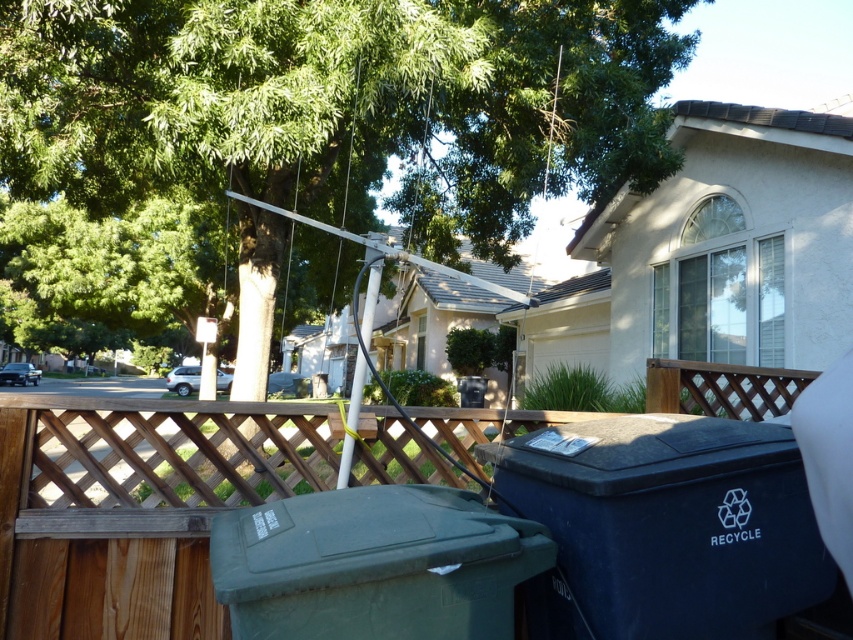
Which of these two, matte black recycling bin at lower right or green plastic recycling bin at lower center, stands taller?

matte black recycling bin at lower right is taller.

Can you confirm if matte black recycling bin at lower right is positioned below green plastic recycling bin at lower center?

Correct, matte black recycling bin at lower right is located below green plastic recycling bin at lower center.

The height and width of the screenshot is (640, 853). I want to click on matte black recycling bin at lower right, so click(665, 525).

Locate an element on the screen. matte black recycling bin at lower right is located at coordinates pyautogui.click(x=665, y=525).

Can you confirm if green leafy tree at upper left is wider than matte black recycling bin at lower right?

Indeed, green leafy tree at upper left has a greater width compared to matte black recycling bin at lower right.

Who is more distant from viewer, (322, 300) or (692, 518)?

Point (322, 300)

Who is more forward, (148,28) or (538,625)?

Point (538,625) is more forward.

At what (x,y) coordinates should I click in order to perform the action: click on green leafy tree at upper left. Please return your answer as a coordinate pair (x, y). Looking at the image, I should click on (300, 144).

Based on the photo, is green leafy tree at upper left bigger than green plastic recycling bin at lower center?

Indeed, green leafy tree at upper left has a larger size compared to green plastic recycling bin at lower center.

Is point (512, 58) less distant than point (381, 637)?

No, it is behind (381, 637).

Which is in front, point (347, 202) or point (491, 582)?

Point (491, 582)

Where is `green leafy tree at upper left`? This screenshot has width=853, height=640. green leafy tree at upper left is located at coordinates (300, 144).